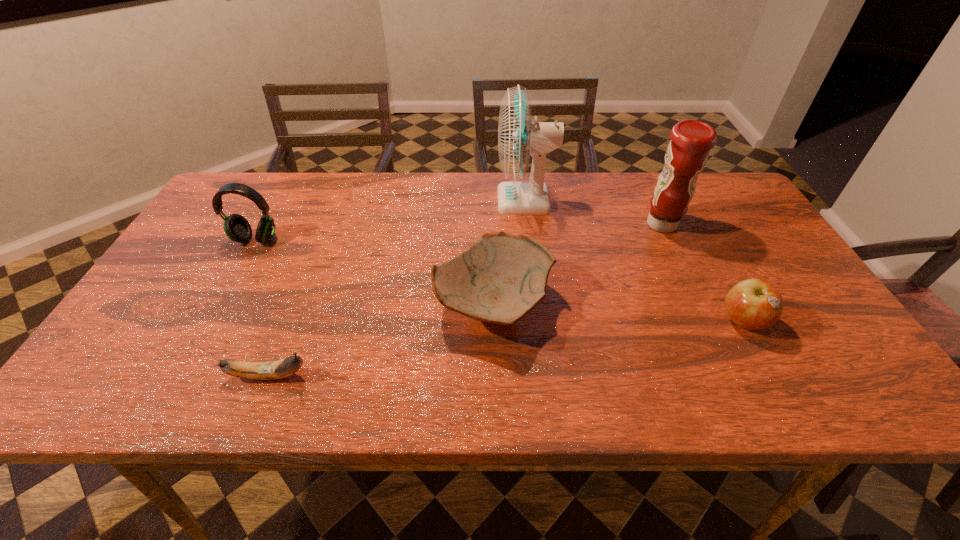
Image resolution: width=960 pixels, height=540 pixels. I want to click on free space between the leftmost object and the second tallest object, so click(x=459, y=232).

Where is `vacant space that is in between the fan and the condiment`? Image resolution: width=960 pixels, height=540 pixels. vacant space that is in between the fan and the condiment is located at coordinates (593, 212).

Find the location of a particular element. This screenshot has height=540, width=960. vacant area that lies between the nearest object and the pottery is located at coordinates (381, 340).

At what (x,y) coordinates should I click in order to perform the action: click on vacant area that lies between the fan and the third tallest object. Please return your answer as a coordinate pair (x, y). This screenshot has width=960, height=540. Looking at the image, I should click on 391,220.

Select which object is the third closest to the apple. Please provide its 2D coordinates. Your answer should be formatted as a tuple, i.e. [(x, y)], where the tuple contains the x and y coordinates of a point satisfying the conditions above.

[(519, 135)]

The height and width of the screenshot is (540, 960). I want to click on object that is the fifth nearest to the fan, so click(269, 370).

Image resolution: width=960 pixels, height=540 pixels. What are the coordinates of `free location that satisfies the following two spatial constraints: 1. on the front side of the pottery; 2. at the stem of the nearest object` in the screenshot? It's located at (495, 375).

Find the location of a particular element. The width and height of the screenshot is (960, 540). free spot that satisfies the following two spatial constraints: 1. in front of the fan to face the airflow; 2. on the back side of the condiment is located at coordinates (528, 225).

I want to click on vacant space that satisfies the following two spatial constraints: 1. on the back side of the second tallest object; 2. in front of the fan to face the airflow, so click(x=650, y=200).

I want to click on vacant space that satisfies the following two spatial constraints: 1. on the ear cups of the leftmost object; 2. on the right side of the pottery, so click(x=220, y=305).